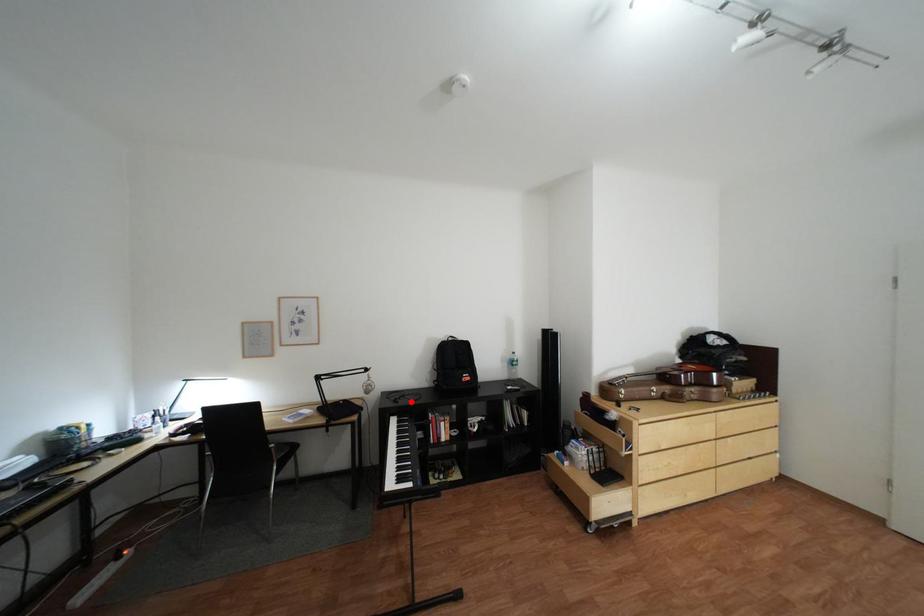
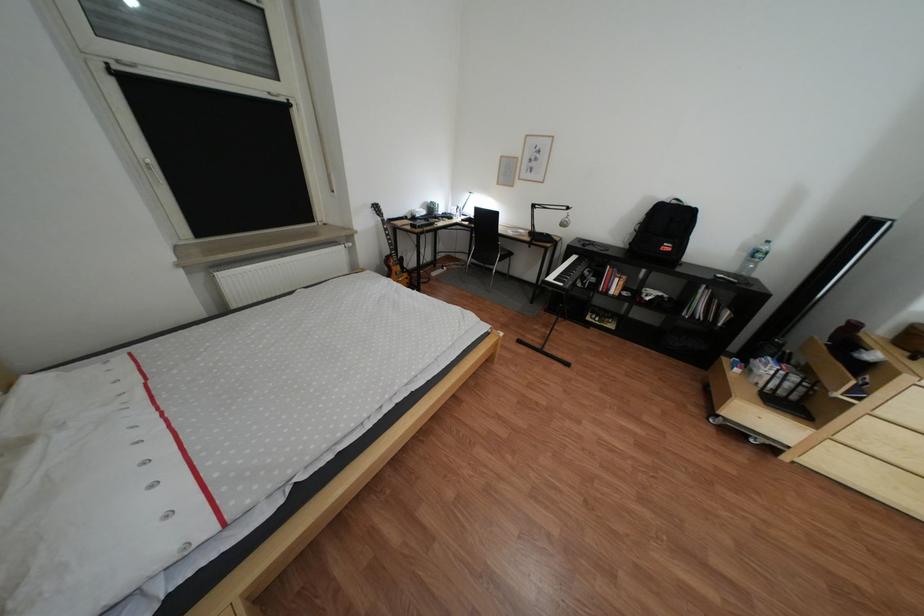
Where in the second image is the point corresponding to the highlighted location from the first image?

(600, 246)